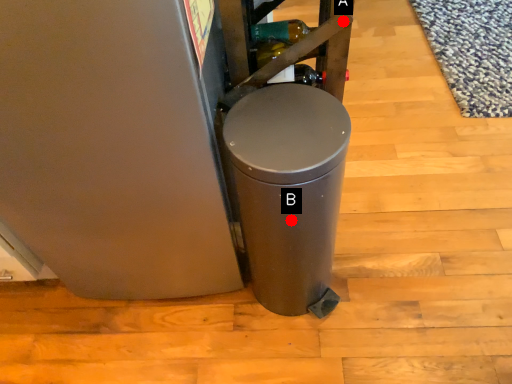
Question: Two points are circled on the image, labeled by A and B beside each circle. Which point appears farthest from the camera in this image?

Choices:
 (A) A is further
 (B) B is further

Answer: (B)